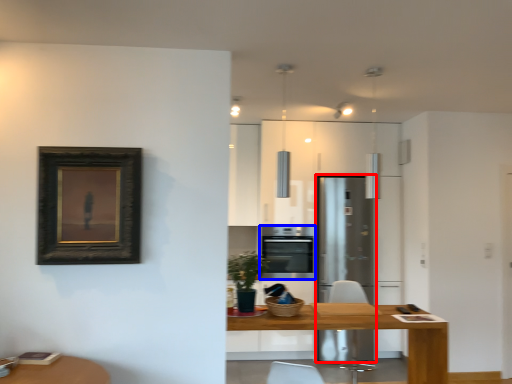
Question: Which point is further to the camera, fridge (highlighted by a red box) or oven (highlighted by a blue box)?

Choices:
 (A) fridge
 (B) oven

Answer: (B)